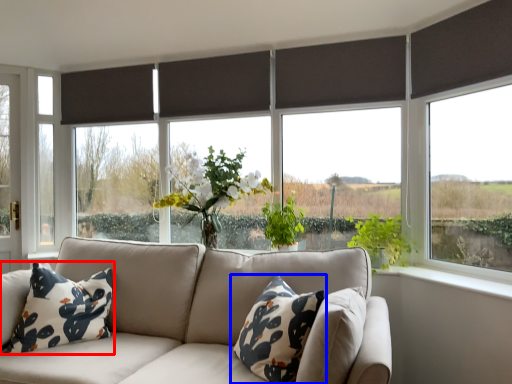
Question: Among these objects, which one is nearest to the camera, pillow (highlighted by a red box) or pillow (highlighted by a blue box)?

Choices:
 (A) pillow
 (B) pillow

Answer: (B)